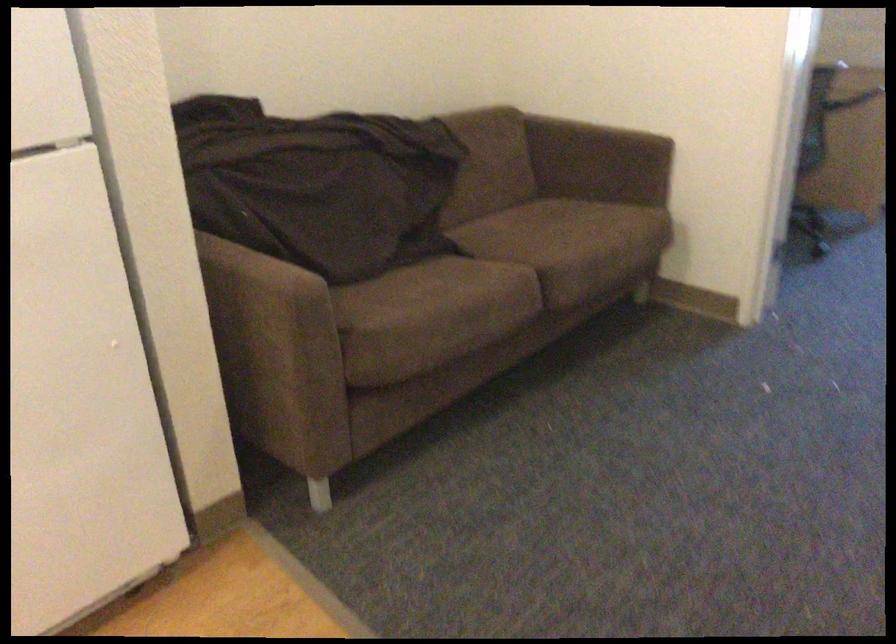
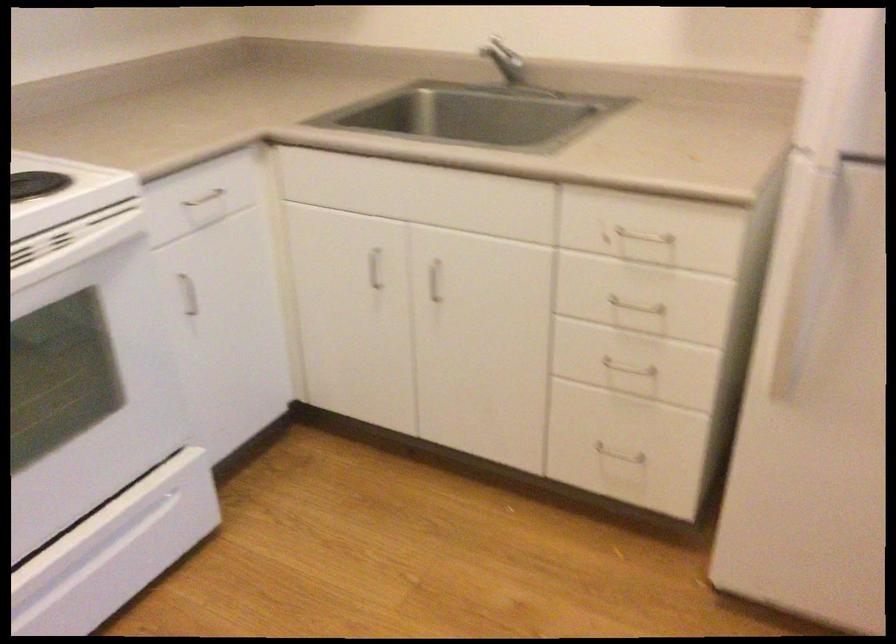
The first image is from the beginning of the video and the second image is from the end. How did the camera likely rotate when shooting the video?

The camera's rotation is toward left-down.